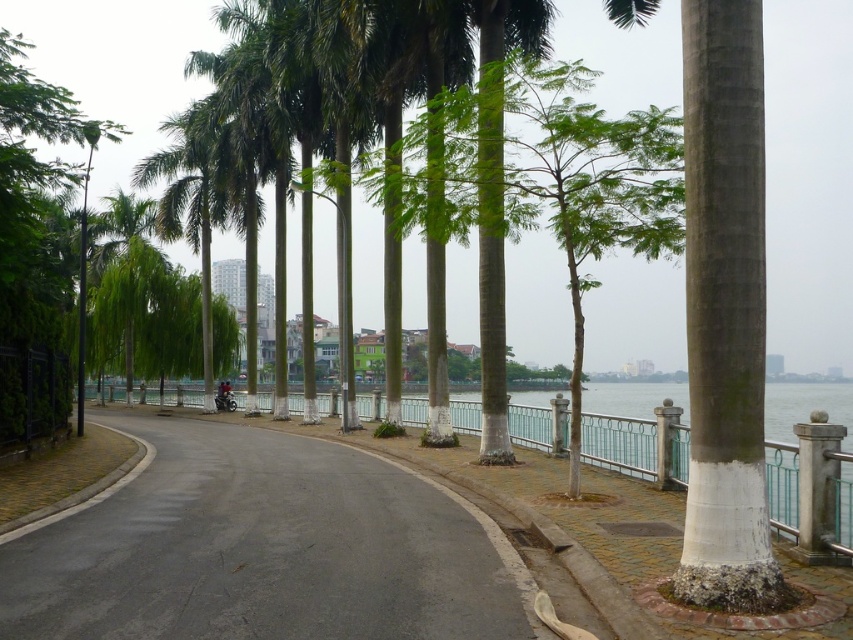
You are standing on the waterfront path and want to reach the point marked at coordinates (757, 372). Given that the railing is 2 meters wide, can you safely walk to that point without crossing the railing?

The point marked at coordinates (757, 372) is 5.93 meters away from the viewer, which is farther than the 2 meters width of the railing. Therefore, you can safely walk to that point without crossing the railing.